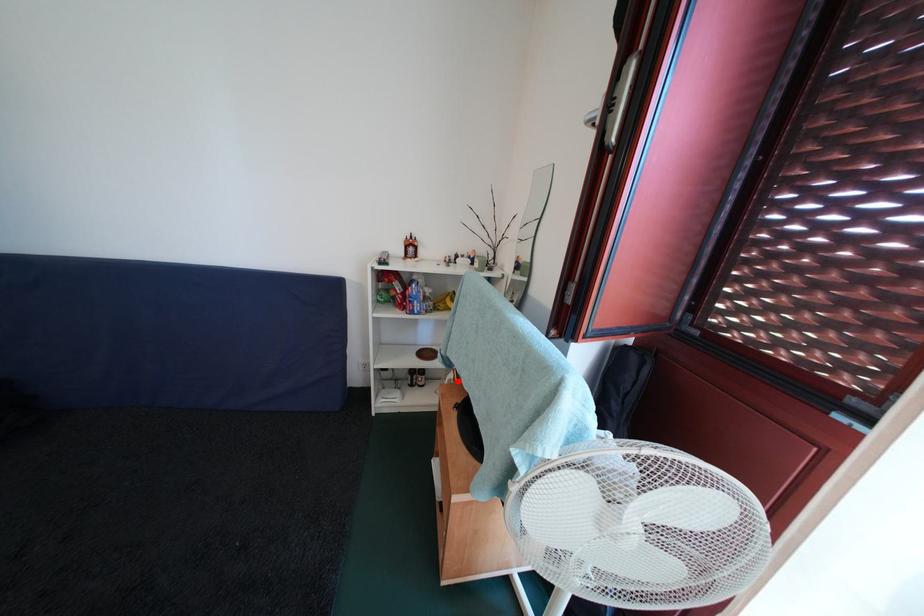
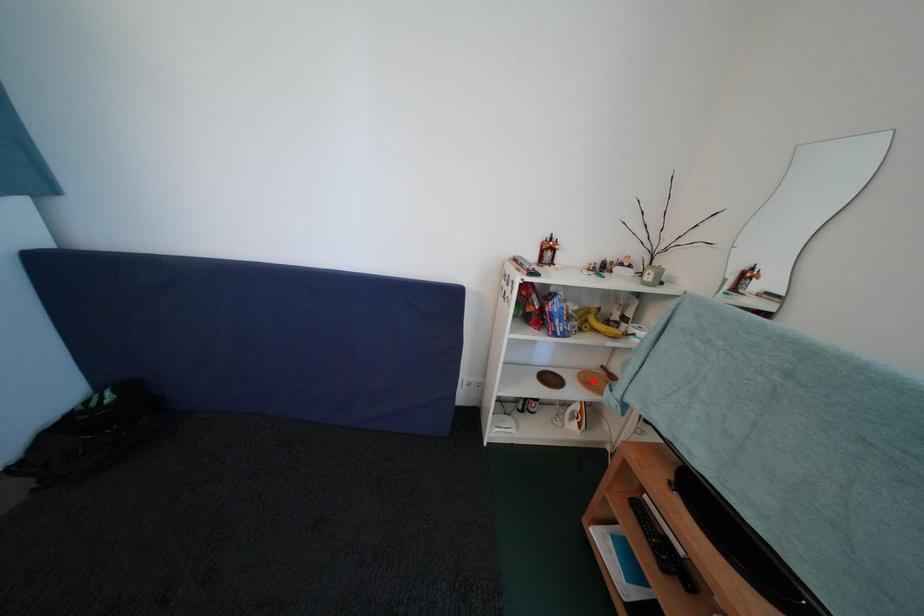
I am providing you with two images of the same scene from different viewpoints. A red point is marked on the first image and another point is marked on the second image. Do the highlighted points in image1 and image2 indicate the same real-world spot?

No